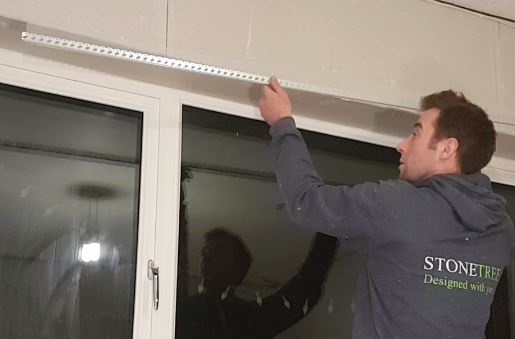
This screenshot has height=339, width=515. I want to click on rod, so point(146,56).